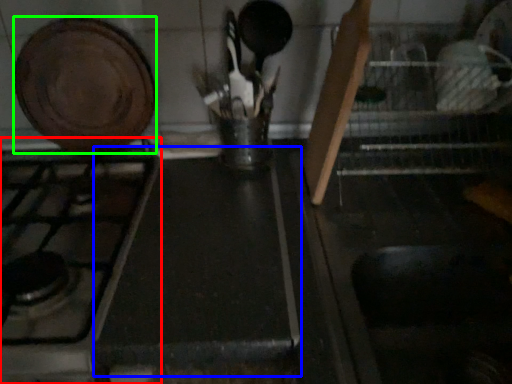
Question: Which object is the closest to the gas stove (highlighted by a red box)? Choose among these: counter top (highlighted by a blue box) or kitchen appliance (highlighted by a green box).

Choices:
 (A) counter top
 (B) kitchen appliance

Answer: (A)